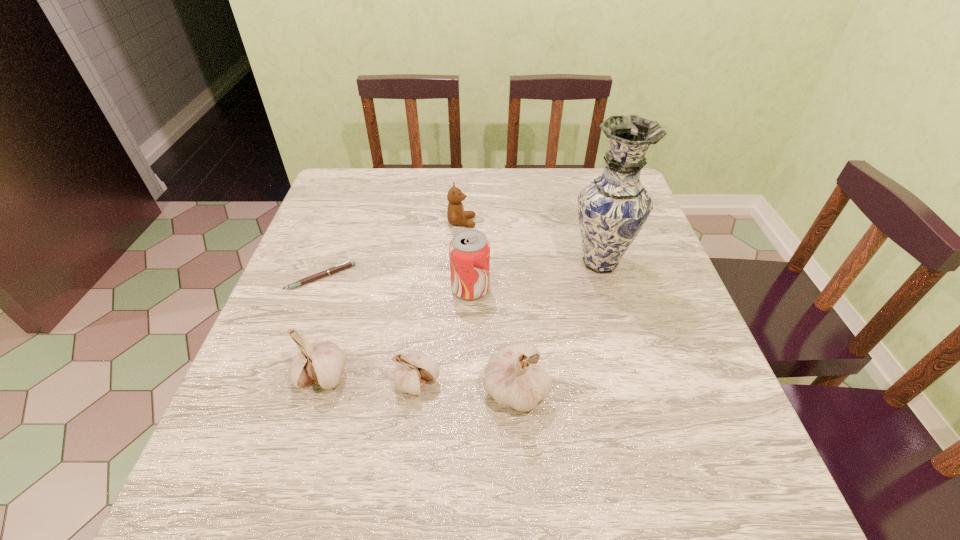
The height and width of the screenshot is (540, 960). What are the coordinates of `the second tallest garlic` in the screenshot? It's located at (321, 363).

The height and width of the screenshot is (540, 960). Find the location of `the second shortest object`. the second shortest object is located at coordinates (412, 371).

The height and width of the screenshot is (540, 960). In order to click on the second garlic from right to left in this screenshot , I will do `click(412, 371)`.

At what (x,y) coordinates should I click in order to perform the action: click on the tallest garlic. Please return your answer as a coordinate pair (x, y). Looking at the image, I should click on (512, 377).

Locate an element on the screen. The height and width of the screenshot is (540, 960). the farthest object is located at coordinates (456, 215).

Identify the location of vase. (612, 209).

Where is `the tallest object`? the tallest object is located at coordinates (612, 209).

Where is `pen`? pen is located at coordinates (347, 264).

Image resolution: width=960 pixels, height=540 pixels. In order to click on soda can in this screenshot , I will do `click(469, 250)`.

At what (x,y) coordinates should I click in order to perform the action: click on vacant space located on the back of the leftmost garlic. Please return your answer as a coordinate pair (x, y). The height and width of the screenshot is (540, 960). Looking at the image, I should click on (348, 290).